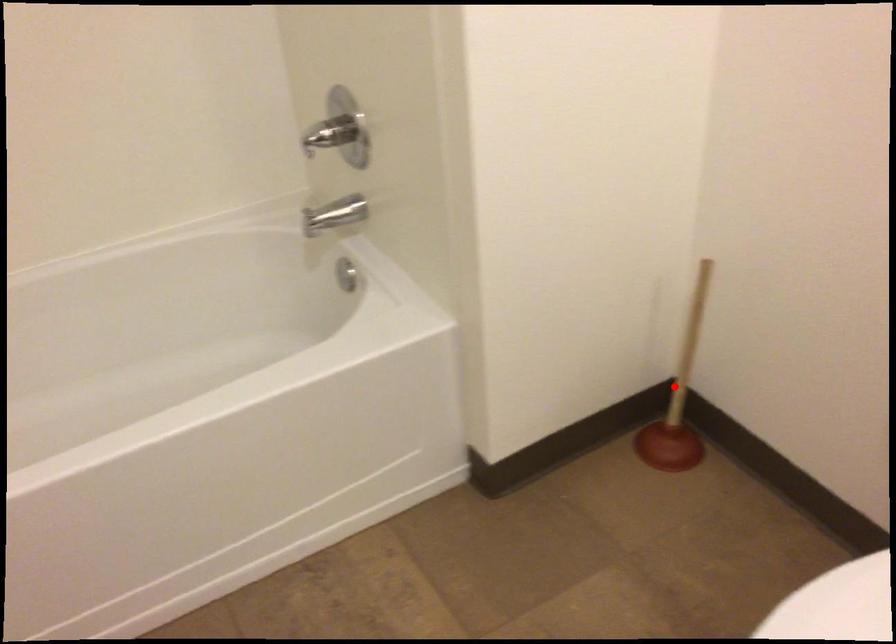
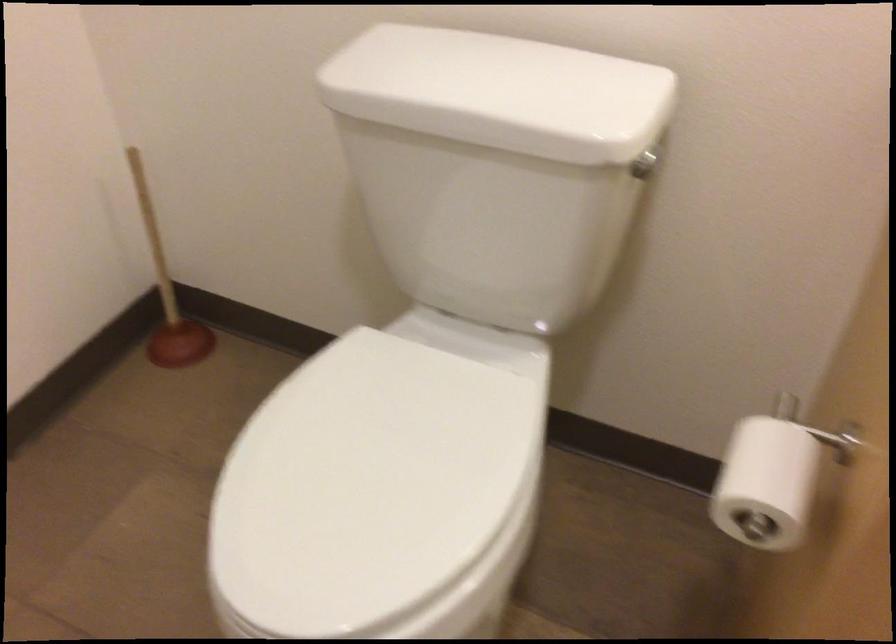
In the second image, find the point that corresponds to the highlighted location in the first image.

(167, 292)